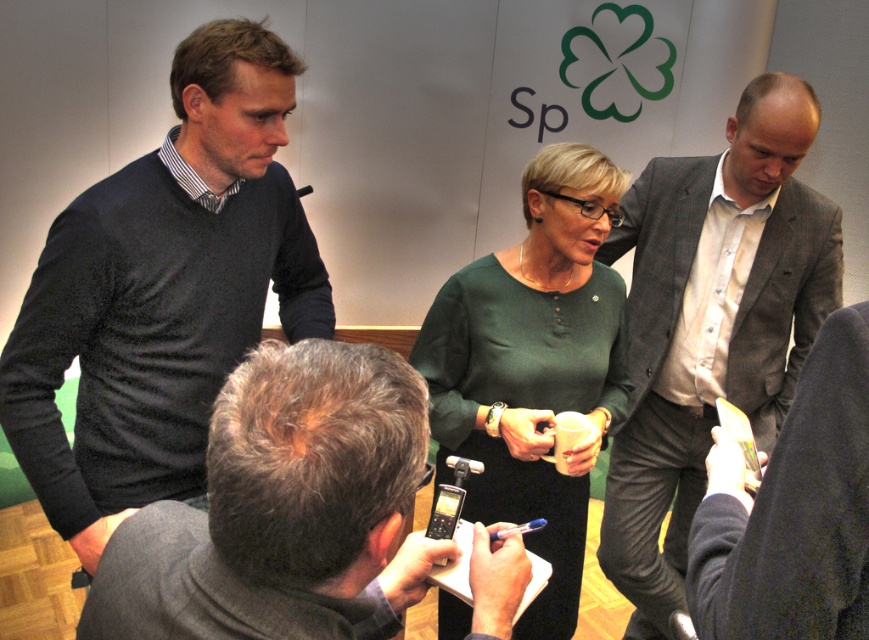
Is dark gray sweater at left bigger than dark gray suit at lower right?

Yes.

Measure the distance between dark gray sweater at left and camera.

dark gray sweater at left and camera are 3.88 feet apart.

Where is `dark gray sweater at left`? dark gray sweater at left is located at coordinates (163, 292).

Based on the photo, does gray suit jacket at center appear over green matte dress at center?

Actually, gray suit jacket at center is below green matte dress at center.

Which is more to the left, gray suit jacket at center or green matte dress at center?

green matte dress at center is more to the left.

The image size is (869, 640). What do you see at coordinates (711, 326) in the screenshot?
I see `gray suit jacket at center` at bounding box center [711, 326].

Identify the location of gray suit jacket at center. The height and width of the screenshot is (640, 869). (711, 326).

Can you confirm if gray suit jacket at center is bigger than dark gray suit at lower right?

Indeed, gray suit jacket at center has a larger size compared to dark gray suit at lower right.

Is gray suit jacket at center shorter than dark gray suit at lower right?

In fact, gray suit jacket at center may be taller than dark gray suit at lower right.

This screenshot has height=640, width=869. I want to click on gray suit jacket at center, so click(x=711, y=326).